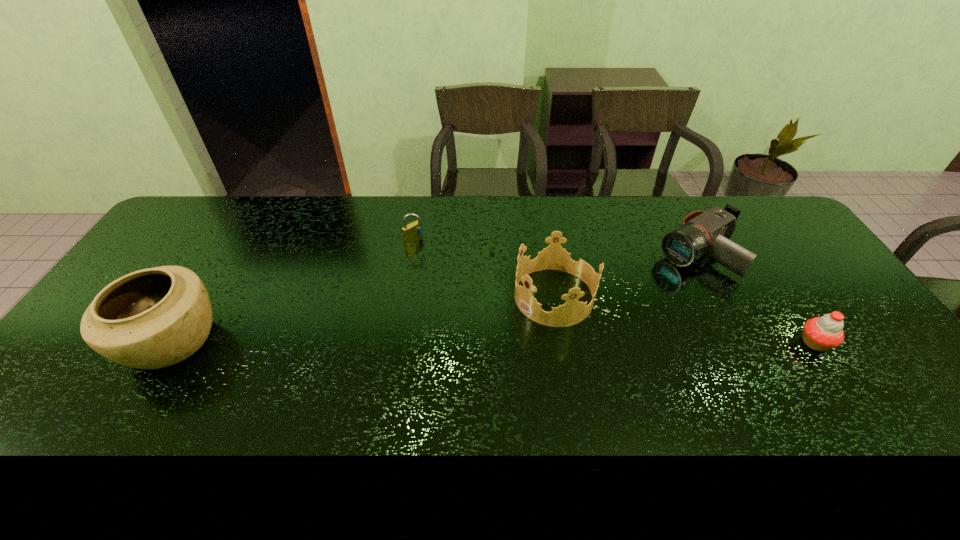
The height and width of the screenshot is (540, 960). I want to click on free point between the cupcake and the fourth shortest object, so (x=684, y=320).

This screenshot has width=960, height=540. I want to click on unoccupied position between the cupcake and the second object from left to right, so click(614, 291).

The image size is (960, 540). In order to click on unoccupied position between the fourth object from right to left and the second tallest object in this screenshot , I will do `click(484, 268)`.

Locate an element on the screen. vacant region between the pottery and the fourth object from right to left is located at coordinates tap(293, 290).

Locate an element on the screen. The image size is (960, 540). vacant area that lies between the fourth shortest object and the cupcake is located at coordinates (684, 320).

Find the location of a particular element. The height and width of the screenshot is (540, 960). free space between the third object from right to left and the cupcake is located at coordinates (684, 320).

Where is `free space between the pottery and the camcorder`? free space between the pottery and the camcorder is located at coordinates (436, 296).

Locate which object ranks third in proximity to the camcorder. Please provide its 2D coordinates. Your answer should be formatted as a tuple, i.e. [(x, y)], where the tuple contains the x and y coordinates of a point satisfying the conditions above.

[(413, 231)]

Image resolution: width=960 pixels, height=540 pixels. In order to click on object that ranks as the closest to the tallest object in this screenshot , I will do `click(413, 231)`.

Image resolution: width=960 pixels, height=540 pixels. Find the location of `free space in the image that satisfies the following two spatial constraints: 1. on the back side of the camcorder; 2. on the left side of the tallest object`. free space in the image that satisfies the following two spatial constraints: 1. on the back side of the camcorder; 2. on the left side of the tallest object is located at coordinates (226, 252).